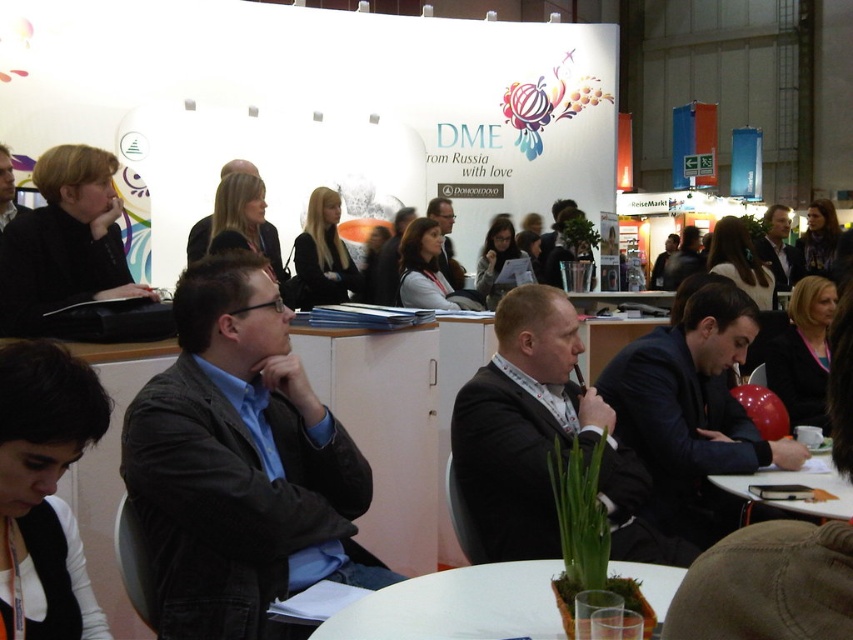
Consider the image. Does dark suit at center have a lesser width compared to white plastic table at center?

Indeed, dark suit at center has a lesser width compared to white plastic table at center.

Who is positioned more to the right, dark suit at center or white plastic table at center?

dark suit at center

What are the coordinates of `dark suit at center` in the screenshot? It's located at (692, 412).

Is dark suit at center in front of white paper at lower right?

No, dark suit at center is behind white paper at lower right.

Between dark suit at center and white paper at lower right, which one appears on the left side from the viewer's perspective?

dark suit at center

Identify the location of dark suit at center. (692, 412).

Locate an element on the screen. The image size is (853, 640). dark suit at center is located at coordinates (692, 412).

Can you confirm if dark gray jacket at center is positioned to the left of white plastic table at center?

Yes, dark gray jacket at center is to the left of white plastic table at center.

From the picture: Which is above, dark gray jacket at center or white plastic table at center?

dark gray jacket at center is higher up.

Is point (183, 518) positioned behind point (659, 572)?

Yes, it is behind point (659, 572).

Locate an element on the screen. This screenshot has width=853, height=640. dark gray jacket at center is located at coordinates (239, 464).